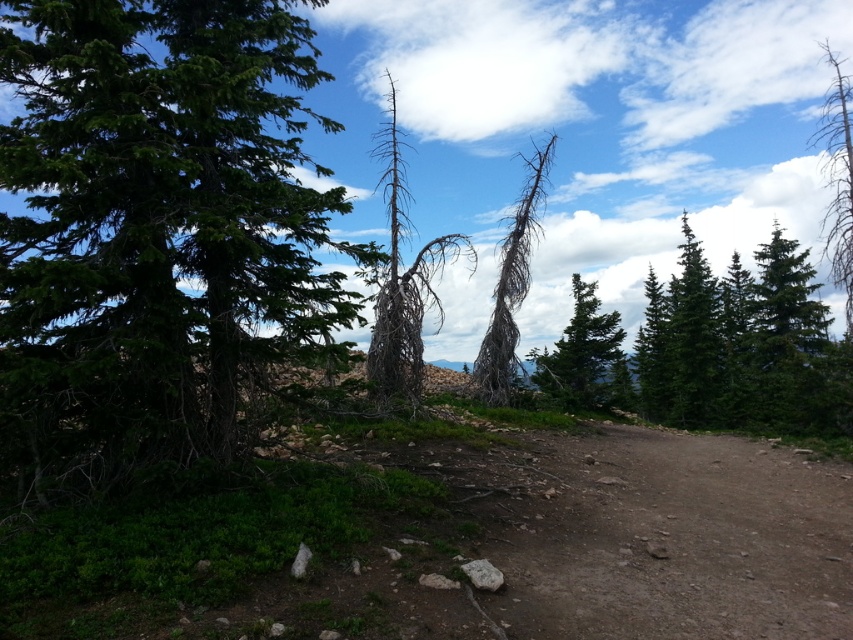
Does green matte tree at upper right appear on the right side of gray bark tree at center?

Correct, you'll find green matte tree at upper right to the right of gray bark tree at center.

Is green matte tree at upper right above gray bark tree at center?

Actually, green matte tree at upper right is below gray bark tree at center.

Who is more distant from viewer, (793, 250) or (527, 218)?

The point (793, 250) is more distant.

Where is `green matte tree at upper right`? This screenshot has height=640, width=853. green matte tree at upper right is located at coordinates (786, 340).

Can you confirm if green matte tree at left is wider than gray-brown deadwood at center?

No, green matte tree at left is not wider than gray-brown deadwood at center.

Is green matte tree at left thinner than gray-brown deadwood at center?

Yes.

Locate an element on the screen. The width and height of the screenshot is (853, 640). green matte tree at left is located at coordinates (155, 234).

Is green matte tree at upper right to the right of bare wood tree at upper right from the viewer's perspective?

No, green matte tree at upper right is not to the right of bare wood tree at upper right.

From the picture: Who is positioned more to the left, green matte tree at upper right or bare wood tree at upper right?

Positioned to the left is green matte tree at upper right.

Locate an element on the screen. The width and height of the screenshot is (853, 640). green matte tree at upper right is located at coordinates (786, 340).